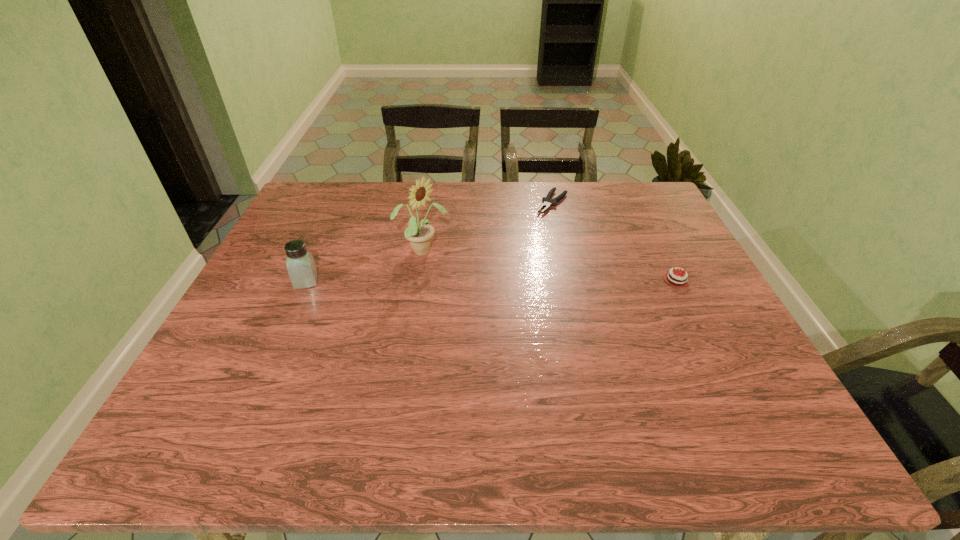
This screenshot has height=540, width=960. Identify the location of free space between the tallest object and the farthest object. (488, 227).

Find the location of a particular element. The height and width of the screenshot is (540, 960). vacant space that is in between the tallest object and the chocolate cake is located at coordinates (549, 266).

The height and width of the screenshot is (540, 960). Identify the location of vacant area between the rightmost object and the leftmost object. (492, 281).

The height and width of the screenshot is (540, 960). I want to click on vacant space that's between the sunflower and the leftmost object, so click(x=364, y=266).

Locate an element on the screen. Image resolution: width=960 pixels, height=540 pixels. vacant area between the pliers and the sunflower is located at coordinates (488, 227).

The image size is (960, 540). In order to click on the closest object to the sunflower in this screenshot , I will do `click(301, 267)`.

Locate which object ranks in proximity to the leftmost object. Please provide its 2D coordinates. Your answer should be formatted as a tuple, i.e. [(x, y)], where the tuple contains the x and y coordinates of a point satisfying the conditions above.

[(419, 234)]

What are the coordinates of `free spot that satisfies the following two spatial constraints: 1. on the front side of the farthest object; 2. on the left side of the chocolate cake` in the screenshot? It's located at (570, 280).

Image resolution: width=960 pixels, height=540 pixels. Identify the location of free space that satisfies the following two spatial constraints: 1. on the back side of the leftmost object; 2. on the left side of the tallest object. (320, 252).

Where is `blank area in the image that satisfies the following two spatial constraints: 1. on the back side of the tallest object; 2. on the left side of the third shortest object`? The width and height of the screenshot is (960, 540). blank area in the image that satisfies the following two spatial constraints: 1. on the back side of the tallest object; 2. on the left side of the third shortest object is located at coordinates (320, 252).